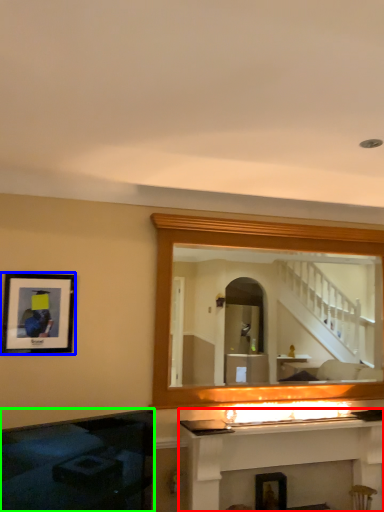
Question: Which is farther away from fireplace (highlighted by a red box)? picture frame (highlighted by a blue box) or fireplace (highlighted by a green box)?

Choices:
 (A) picture frame
 (B) fireplace

Answer: (A)